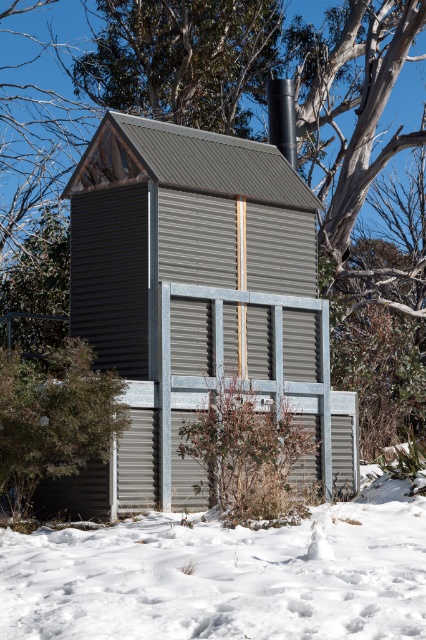
You are standing in front of the gray corrugated metal hut at center and want to see over it to the other side. There is a green leafy shrub at lower left nearby. Can the shrub help you see over the hut?

The gray corrugated metal hut at center is not as tall as the green leafy shrub at lower left, so the shrub is taller. Therefore, standing on the shrub might allow you to see over the hut.

You are an architect designing a new winter cabin. You want to ensure that the cabin is larger than the snowdrift in front of it. Based on the scene provided, does the gray corrugated metal hut at center meet this requirement when compared to the white powdery snow at lower center?

The gray corrugated metal hut at center is bigger than the white powdery snow at lower center, so yes, it meets the requirement of being larger than the snowdrift in front of it.